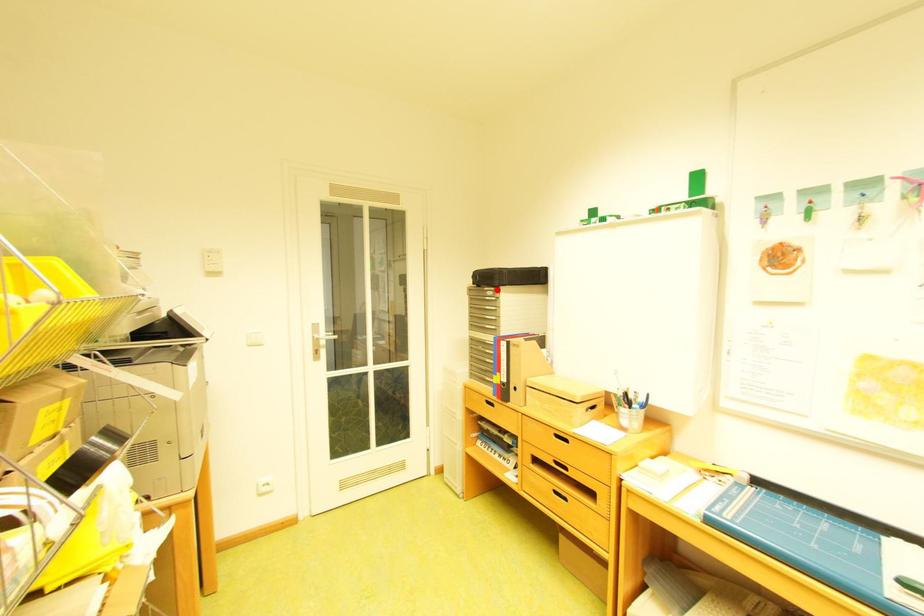
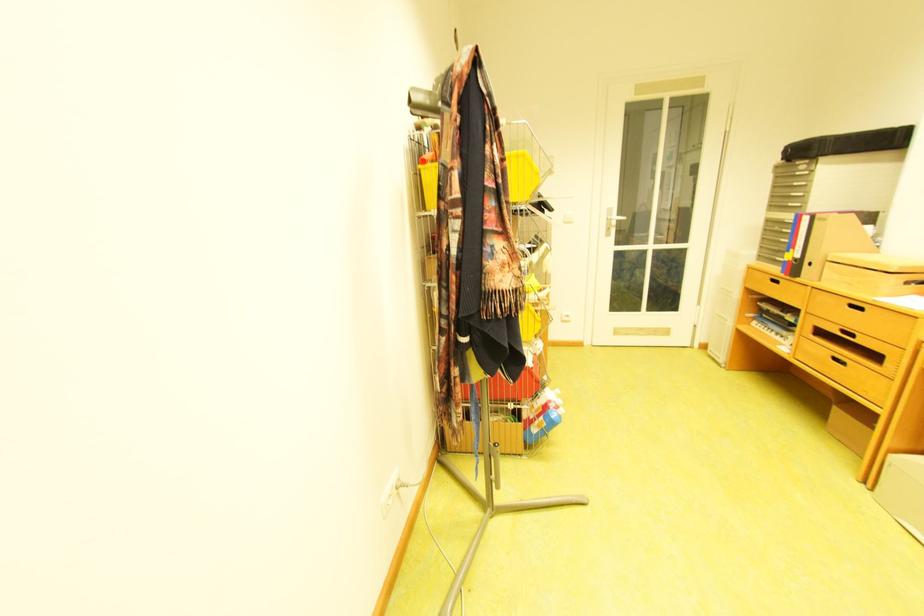
Locate, in the second image, the point that corresponds to the highlighted location in the first image.

(808, 164)